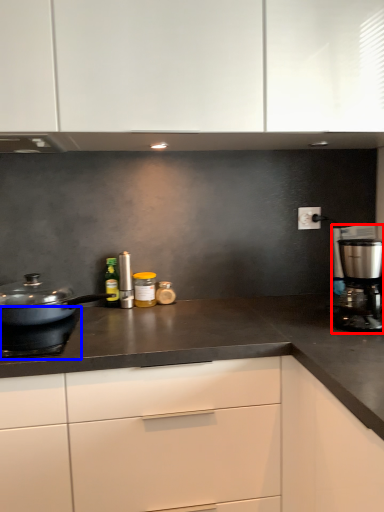
Question: Which point is further to the camera, kitchen appliance (highlighted by a red box) or gas stove (highlighted by a blue box)?

Choices:
 (A) kitchen appliance
 (B) gas stove

Answer: (A)